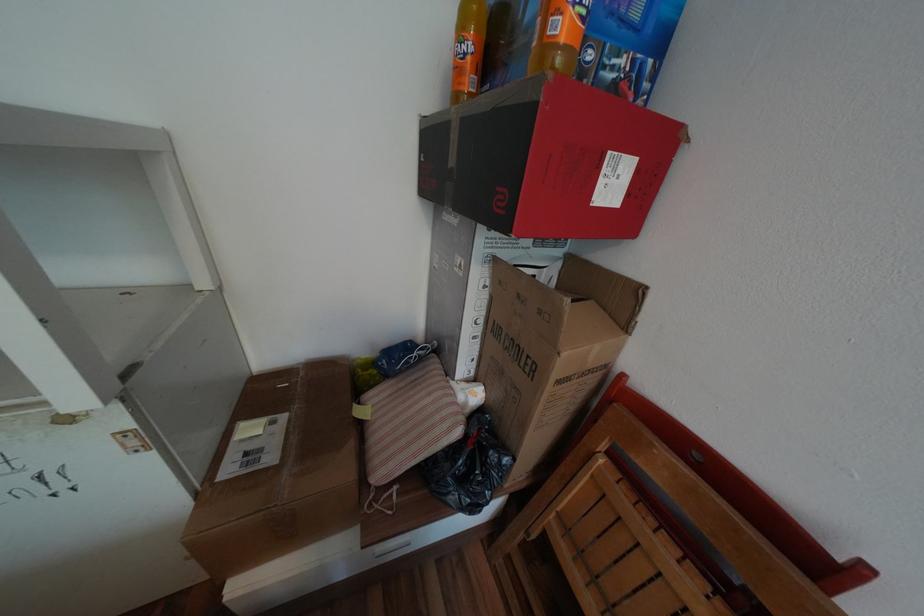
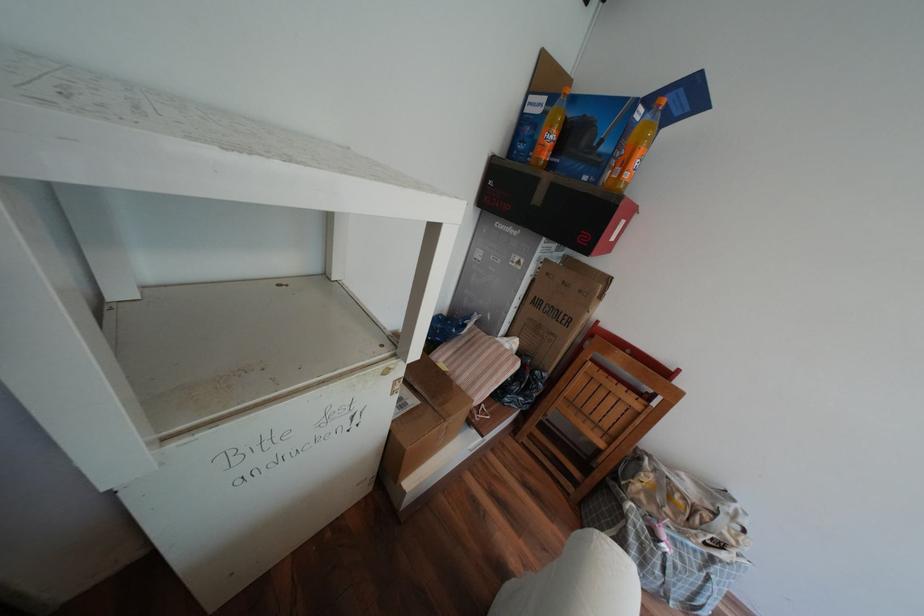
Where in the second image is the point corresponding to point (280, 458) from the first image?

(422, 400)